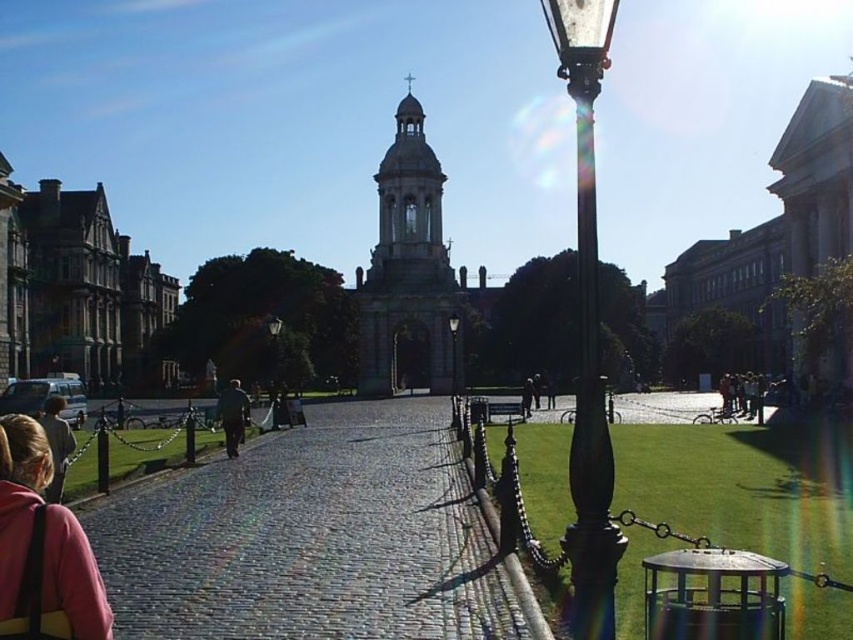
You are a visitor trying to walk from the entrance to the clock tower. You notice the cobblestone path at center and the black polished metal street light at center right. Which object takes up more space in the image?

The black polished metal street light at center right takes up more space in the image than the cobblestone path at center because the cobblestone path at center occupies less space than black polished metal street light at center right.